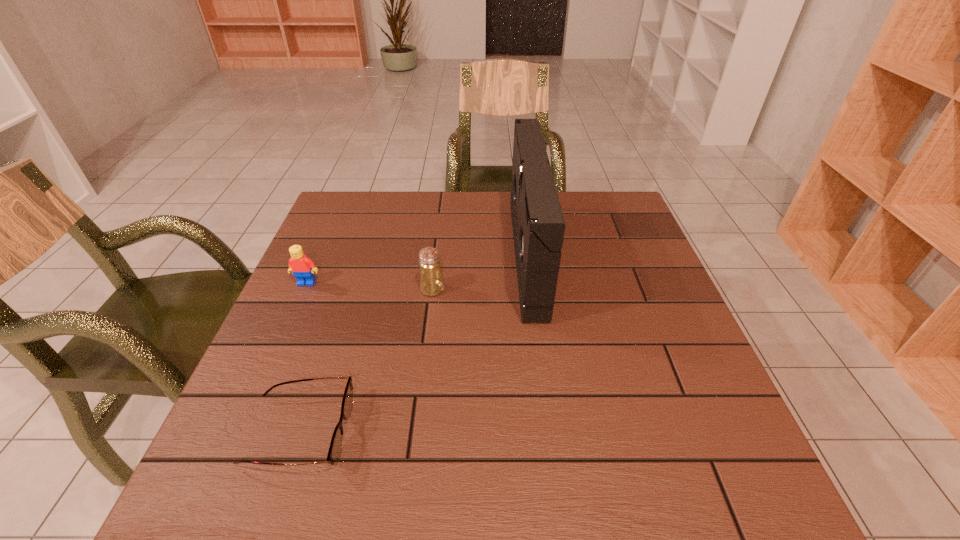
Where is `vacant space positioned 0.260m on the face of the Lego`? The height and width of the screenshot is (540, 960). vacant space positioned 0.260m on the face of the Lego is located at coordinates (266, 375).

Where is `vacant space located on the face of the nearest object`? The image size is (960, 540). vacant space located on the face of the nearest object is located at coordinates (460, 432).

This screenshot has width=960, height=540. I want to click on object present at the far edge, so click(x=538, y=225).

You are a GUI agent. You are given a task and a screenshot of the screen. Output one action in this format:
    pyautogui.click(x=<x>, y=<y>)
    Task: Click on the object present at the near edge
    Image resolution: width=960 pixels, height=540 pixels.
    Given the screenshot: What is the action you would take?
    pyautogui.click(x=335, y=448)

Image resolution: width=960 pixels, height=540 pixels. Find the location of `Lego at the left edge`. Lego at the left edge is located at coordinates (302, 267).

The width and height of the screenshot is (960, 540). I want to click on spectacles that is positioned at the left edge, so click(x=335, y=448).

Locate an element on the screen. The height and width of the screenshot is (540, 960). object at the near left corner is located at coordinates (335, 448).

In the image, there is a desktop. In order to click on vacant space at the far edge in this screenshot , I will do `click(465, 202)`.

The image size is (960, 540). In the image, there is a desktop. Find the location of `vacant space at the left edge`. vacant space at the left edge is located at coordinates (211, 458).

Find the location of a particular element. Image resolution: width=960 pixels, height=540 pixels. free space at the right edge is located at coordinates (618, 328).